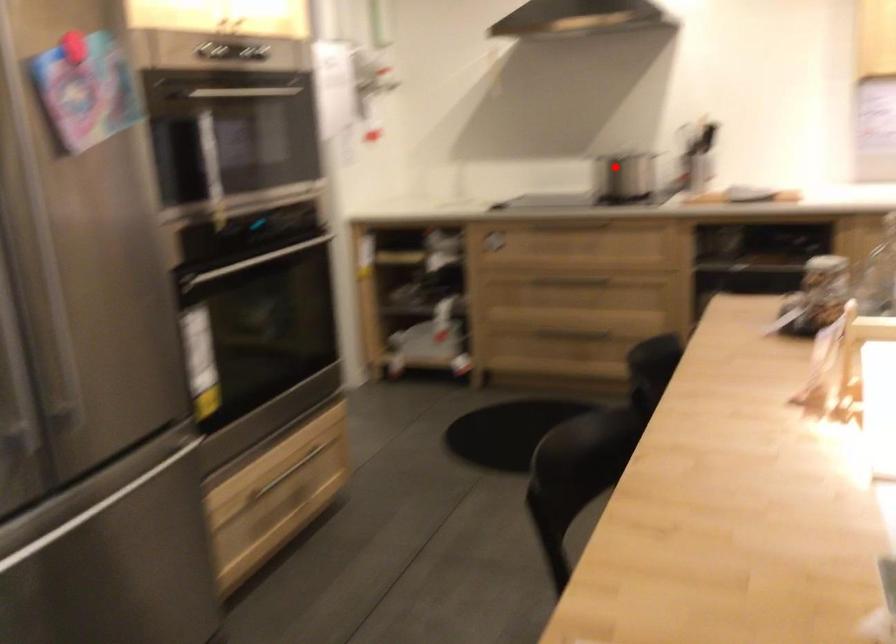
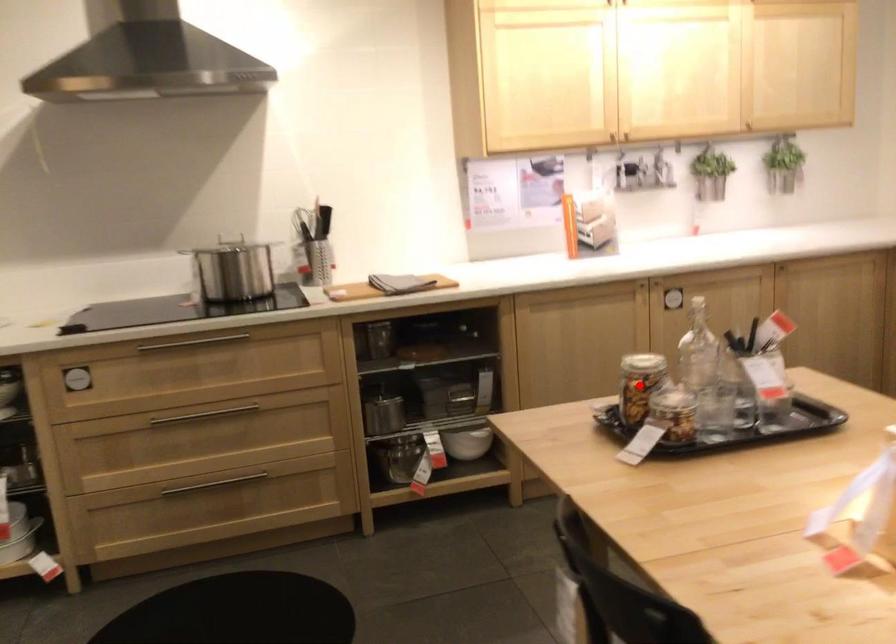
Consider the image. I am providing you with two images of the same scene from different viewpoints. A red point is marked on the first image and another point is marked on the second image. Is the red point in image1 aligned with the point shown in image2?

No